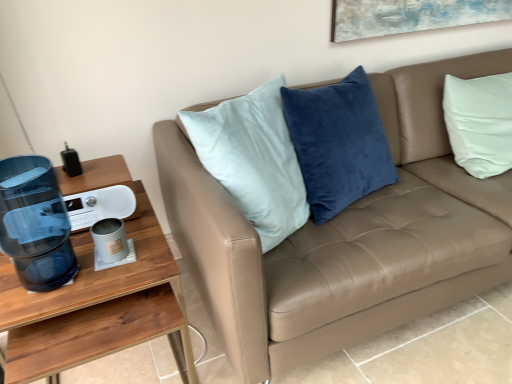
Identify the location of vacant space to the left of matte gray mug at lower left. This screenshot has width=512, height=384. (58, 261).